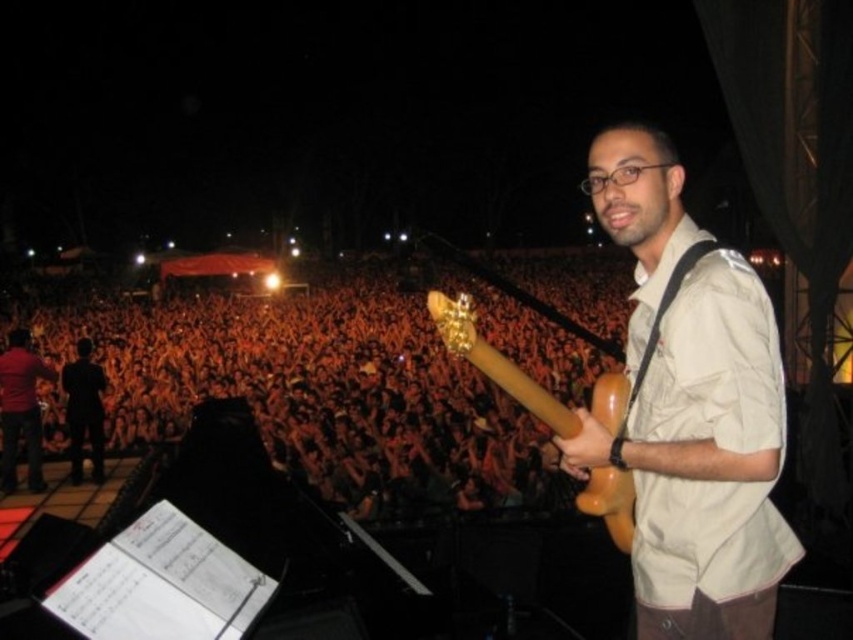
Question: Is dark orange fabric crowd at left wider than matte brown guitar at center?

Choices:
 (A) no
 (B) yes

Answer: (B)

Question: Which of the following is the closest to the observer?

Choices:
 (A) (33, 444)
 (B) (445, 346)
 (C) (722, 628)

Answer: (C)

Question: Which is farther from the dark orange fabric crowd at left?

Choices:
 (A) matte brown guitar at center
 (B) woodenwoodenguitar at right
 (C) red shirt at left

Answer: (B)

Question: Is dark orange fabric crowd at left to the right of red shirt at left from the viewer's perspective?

Choices:
 (A) yes
 (B) no

Answer: (B)

Question: Is dark orange fabric crowd at left bigger than matte brown guitar at center?

Choices:
 (A) yes
 (B) no

Answer: (A)

Question: Which point is farther to the camera?

Choices:
 (A) (654, 225)
 (B) (397, 472)
 (C) (0, 380)

Answer: (C)